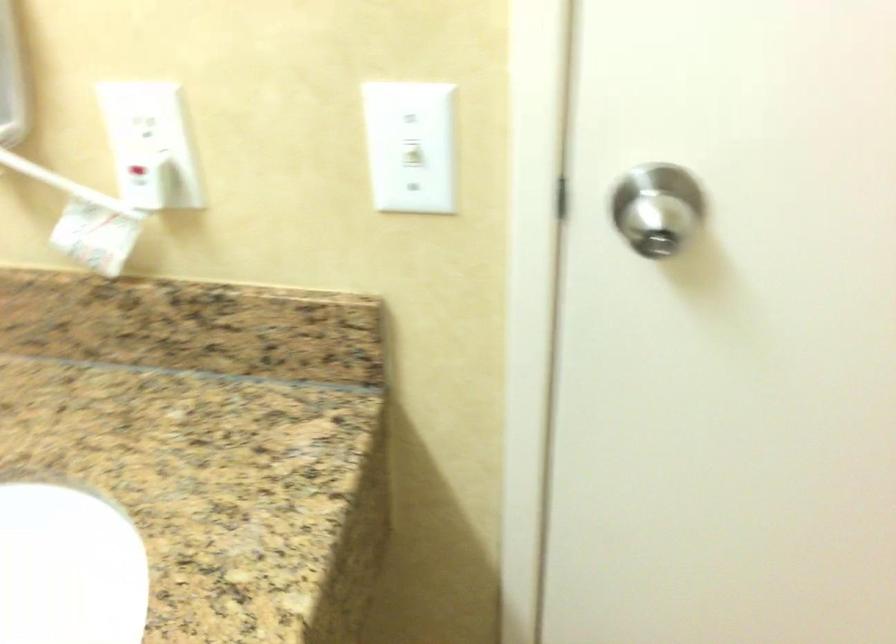
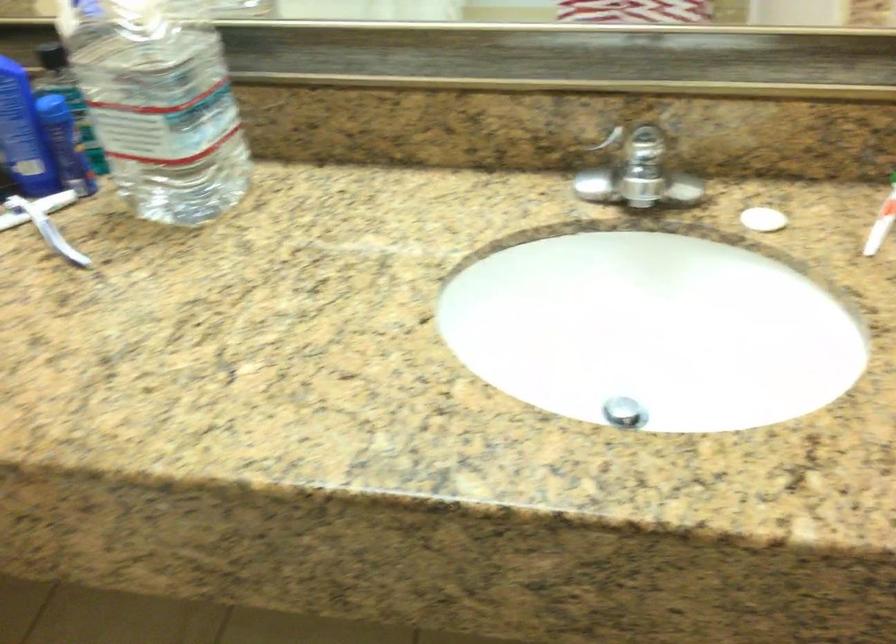
The first image is from the beginning of the video and the second image is from the end. How did the camera likely rotate when shooting the video?

The camera rotated toward left-down.